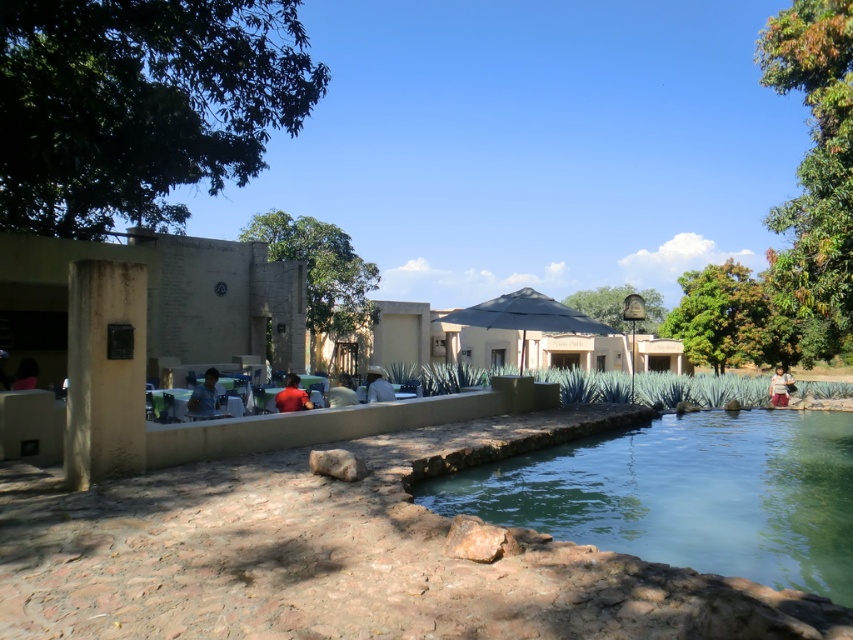
Question: Considering the real-world distances, which object is closest to the dark blue shirt at left?

Choices:
 (A) white cotton shirt at center
 (B) matte red shirt at center
 (C) matte white shirt at center
 (D) blue denim shirt at lower left

Answer: (D)

Question: Estimate the real-world distances between objects in this image. Which object is farther from the matte white shirt at center?

Choices:
 (A) clear glass pool at center
 (B) blue denim jeans at right

Answer: (B)

Question: Is white cotton shirt at center below matte white shirt at center?

Choices:
 (A) no
 (B) yes

Answer: (A)

Question: Estimate the real-world distances between objects in this image. Which object is farther from the clear glass pool at center?

Choices:
 (A) blue denim jeans at right
 (B) dark blue shirt at left
 (C) matte red shirt at center
 (D) blue denim shirt at lower left

Answer: (B)

Question: Is white cotton shirt at center further to camera compared to blue denim jeans at right?

Choices:
 (A) yes
 (B) no

Answer: (B)

Question: Does white cotton shirt at center appear on the right side of dark blue shirt at left?

Choices:
 (A) yes
 (B) no

Answer: (A)